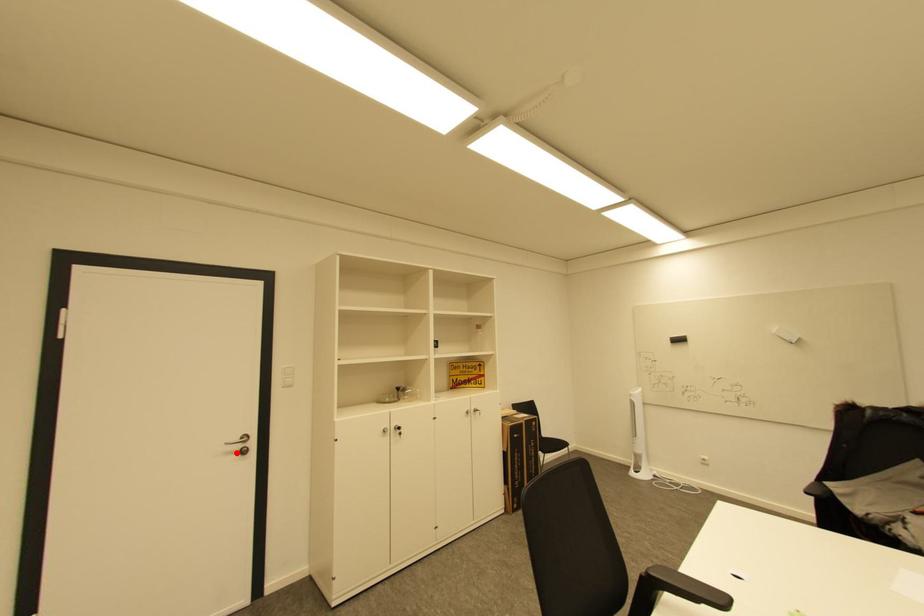
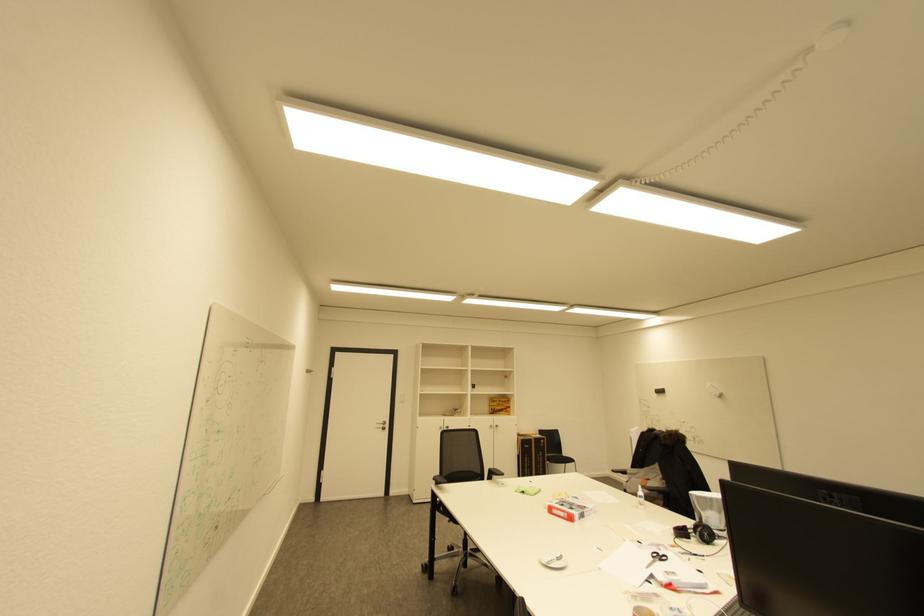
Find the pixel in the second image that matches the highlighted location in the first image.

(385, 429)